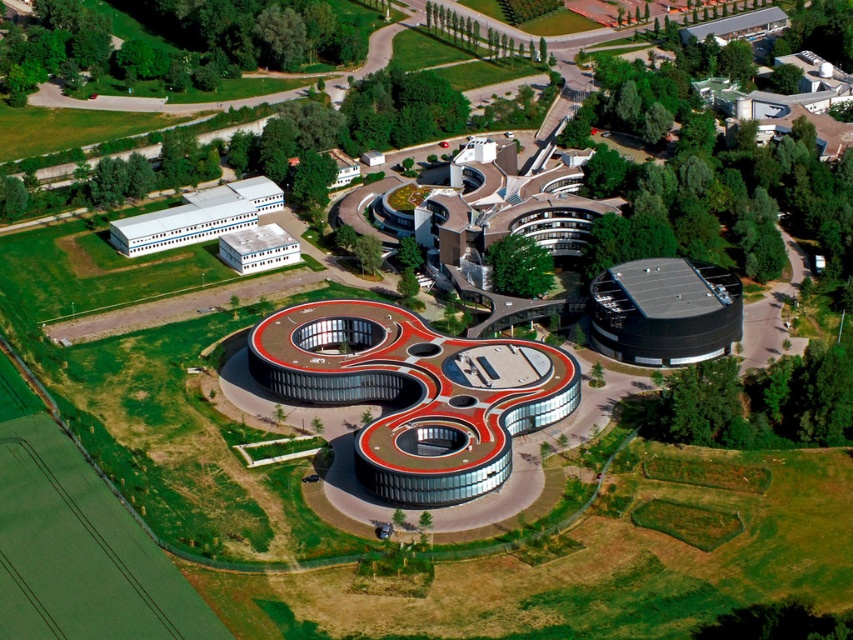
You are a city planner assessing the architectural complex. You need to determine which building has a bigger footprint for potential expansion. Based on the beige textured building at upper center and the white matte building at upper left, which one would you recommend expanding?

The beige textured building at upper center has a larger size compared to the white matte building at upper left, so expanding the beige textured building at upper center would be more feasible due to its existing larger footprint.

Consider the image. You are standing at the central complex and looking towards the surrounding buildings. There are two points marked in the image, point (462, 198) and point (259, 228). Which point is closer to you?

Point (462, 198) is closer to the camera than point (259, 228).

You are standing at the entrance of the architectural complex and want to reach the point marked as point (474, 209). There is an obstacle at point (204, 195). Can you safely walk directly to your destination without going around the obstacle?

Since point (474, 209) is closer to the viewer than point (204, 195), you can safely walk directly to your destination without going around the obstacle because the obstacle is behind you and out of the way.